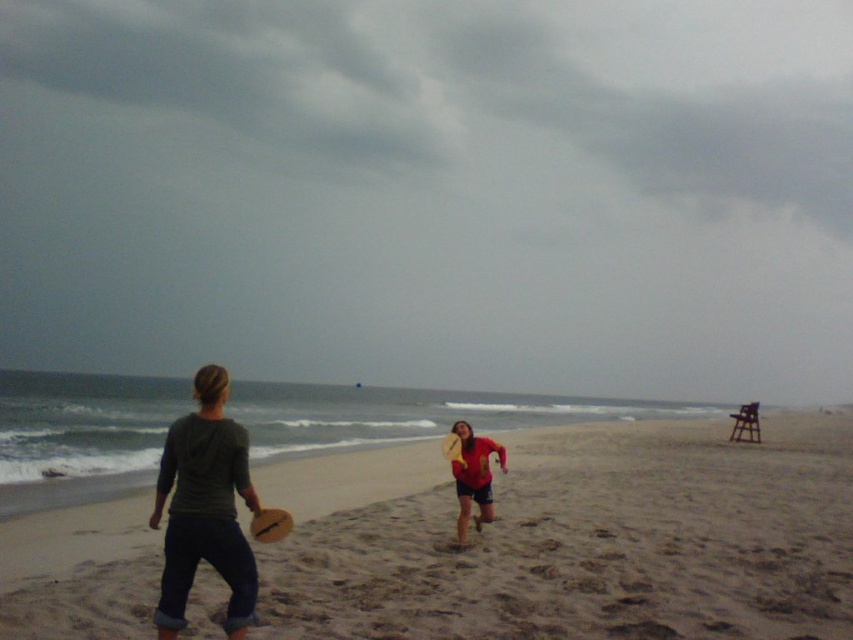
Question: Among these objects, which one is farthest from the camera?

Choices:
 (A) dark gray hoodie at center
 (B) red matte shirt at center
 (C) wooden frisbee at center

Answer: (B)

Question: Estimate the real-world distances between objects in this image. Which object is farther from the red matte shirt at center?

Choices:
 (A) smooth sand at center
 (B) dark gray hoodie at center

Answer: (A)

Question: Estimate the real-world distances between objects in this image. Which object is farther from the dark gray hoodie at center?

Choices:
 (A) smooth sand at center
 (B) red matte shirt at center
 (C) wooden frisbee at center

Answer: (A)

Question: Does red matte shirt at center lie behind wooden frisbee at center?

Choices:
 (A) yes
 (B) no

Answer: (A)

Question: Is dark gray hoodie at center positioned at the back of red matte shirt at center?

Choices:
 (A) yes
 (B) no

Answer: (B)

Question: Considering the relative positions of smooth sand at center and wooden frisbee at center in the image provided, where is smooth sand at center located with respect to wooden frisbee at center?

Choices:
 (A) below
 (B) above

Answer: (A)